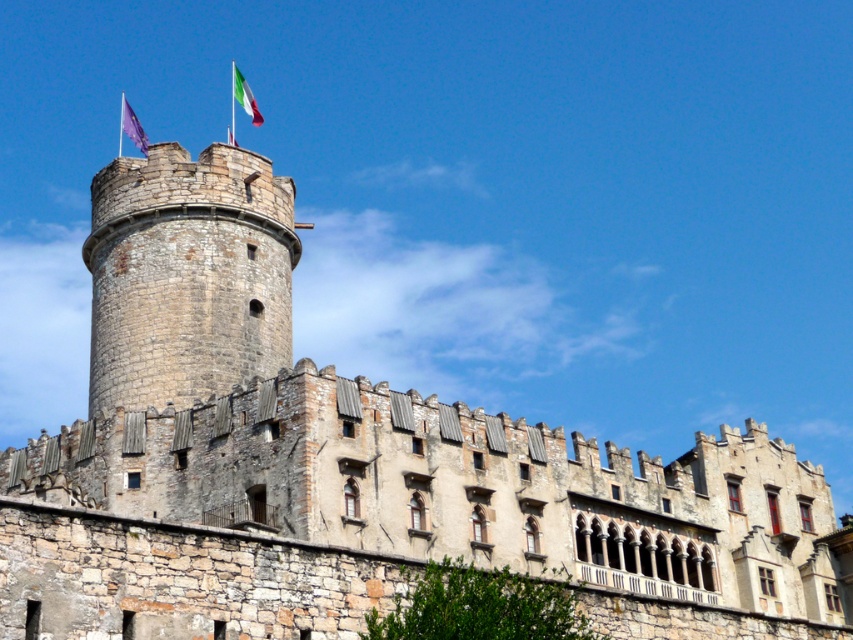
You are a drone operator tasked with capturing aerial footage of the rustic stone tower at center and the green fabric flag at top center. Your drone has a maximum flight range of 40 meters. Can the drone fly from the tower to the flag without exceeding its range?

The rustic stone tower at center is 41.70 meters from the green fabric flag at top center. Since the drone has a maximum flight range of 40 meters, it cannot reach the flag from the tower without exceeding its range.

You are a medieval knight standing at the base of the castle tower. You notice two flags flying above you. Which flag has a larger width, the purple fabric flag at top or the green fabric flag at top center?

The purple fabric flag at top might be wider than the green fabric flag at top center.